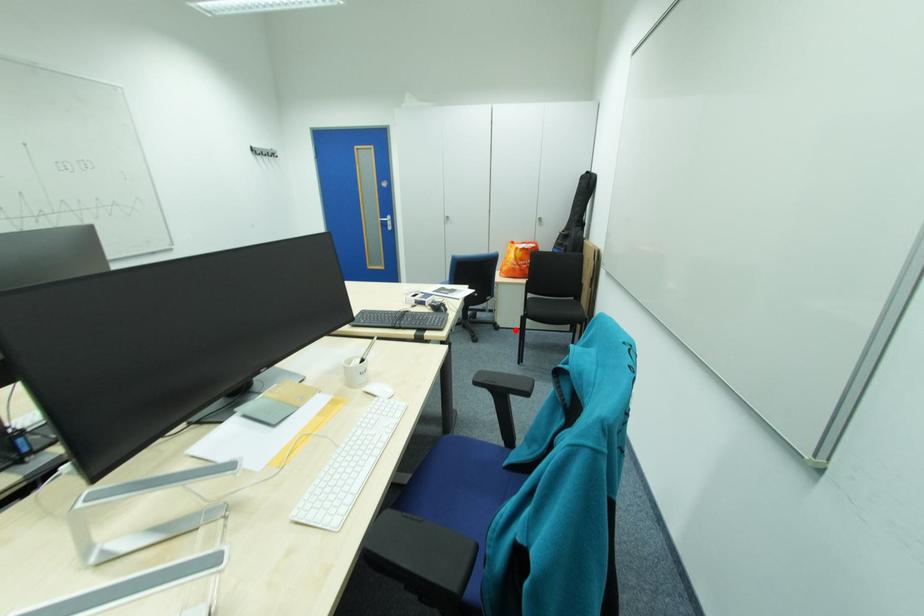
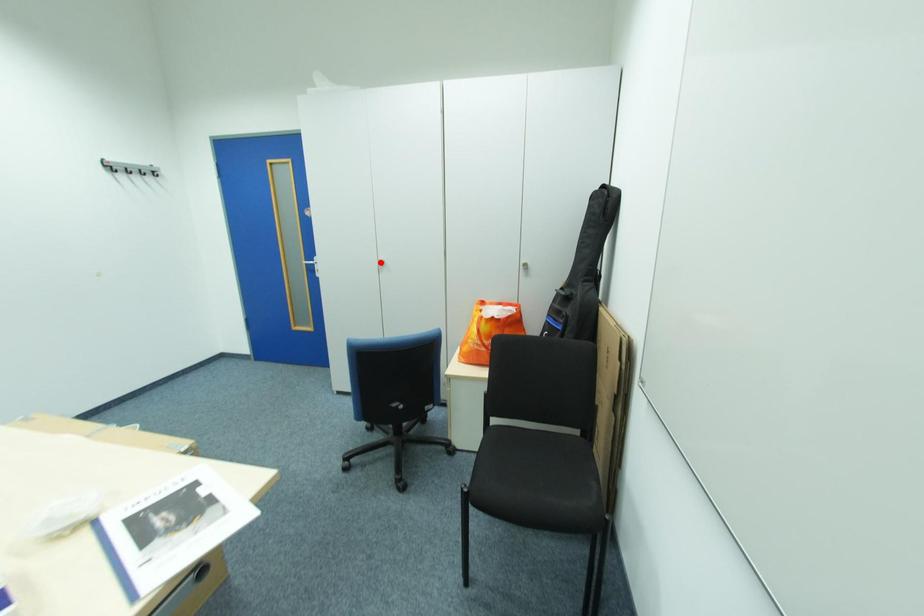
I am providing you with two images of the same scene from different viewpoints. A red point is marked on the first image and another point is marked on the second image. Does the point marked in image1 correspond to the same location as the one in image2?

No